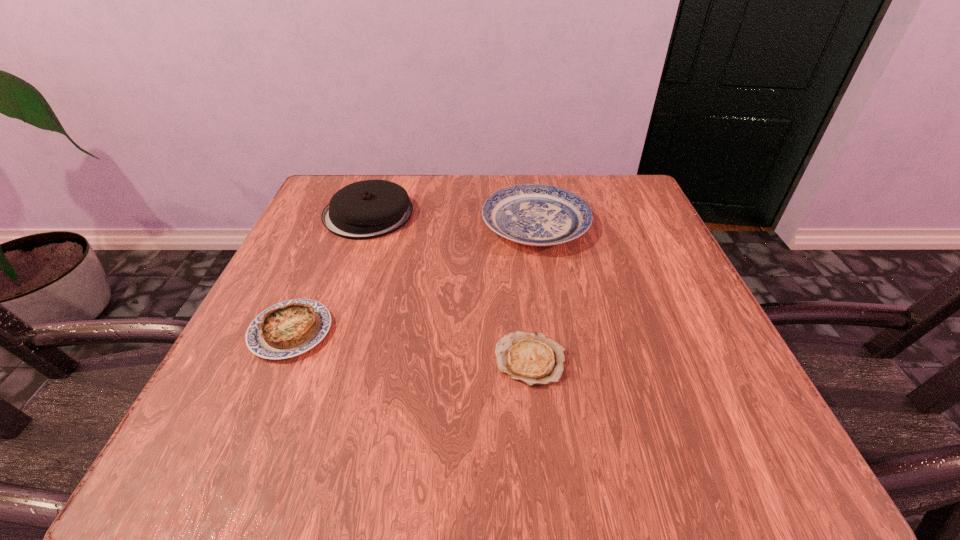
The width and height of the screenshot is (960, 540). In the image, there is a desktop. Find the location of `vacant space at the right edge`. vacant space at the right edge is located at coordinates (630, 341).

This screenshot has width=960, height=540. Find the location of `free region at the near left corner`. free region at the near left corner is located at coordinates (168, 473).

Identify the location of free space between the right quiche and the plate. (533, 292).

Find the location of a particular element. unoccupied area between the pancake and the second shortest object is located at coordinates coord(329,273).

Find the location of `vacant area that lies between the tallest object and the shorter quiche`. vacant area that lies between the tallest object and the shorter quiche is located at coordinates (449, 287).

At what (x,y) coordinates should I click in order to perform the action: click on free space between the right quiche and the tallest object. Please return your answer as a coordinate pair (x, y). Image resolution: width=960 pixels, height=540 pixels. Looking at the image, I should click on (449, 287).

The height and width of the screenshot is (540, 960). Find the location of `empty space between the pancake and the plate`. empty space between the pancake and the plate is located at coordinates (452, 219).

Where is `free space between the plate and the shorter quiche`? The image size is (960, 540). free space between the plate and the shorter quiche is located at coordinates (533, 292).

Identify the location of unoccupied area between the taller quiche and the right quiche. (411, 346).

The image size is (960, 540). I want to click on unoccupied position between the tallest object and the right quiche, so click(449, 287).